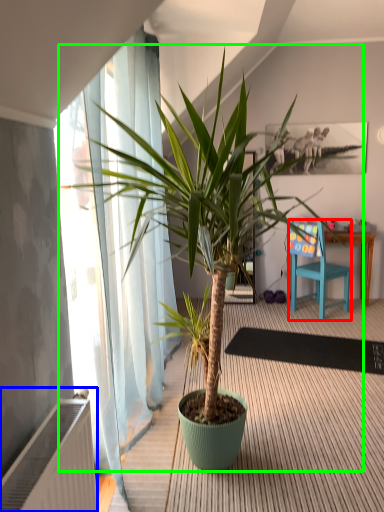
Question: Considering the real-world distances, which object is closest to chair (highlighted by a red box)? radiator (highlighted by a blue box) or houseplant (highlighted by a green box).

Choices:
 (A) radiator
 (B) houseplant

Answer: (B)